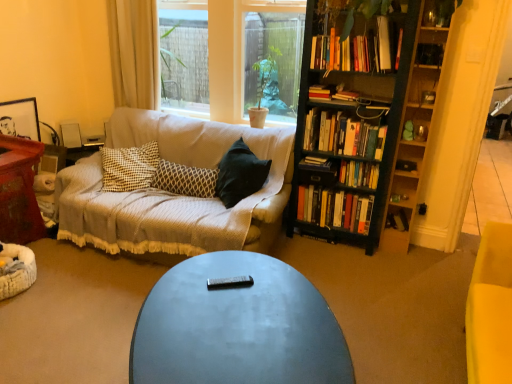
Where is `free space above hardcover book at upper center, which ranks as the third book in top-to-bottom order (from a real-world perspective)`? Image resolution: width=512 pixels, height=384 pixels. free space above hardcover book at upper center, which ranks as the third book in top-to-bottom order (from a real-world perspective) is located at coordinates (349, 92).